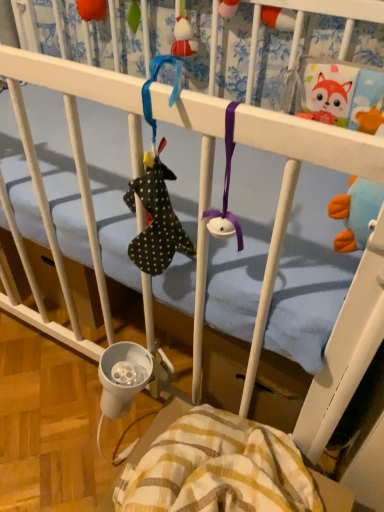
Question: From a real-world perspective, is orange fabric toy at upper left, positioned as the first toy in left-to-right order, physically below matte red plush toy at upper center, the first toy positioned from the right?

Choices:
 (A) yes
 (B) no

Answer: (B)

Question: Does orange fabric toy at upper left, positioned as the first toy in left-to-right order, have a larger size compared to matte red plush toy at upper center, which ranks as the second toy in left-to-right order?

Choices:
 (A) yes
 (B) no

Answer: (B)

Question: Is orange fabric toy at upper left, which is the 2th toy in right-to-left order, at the right side of matte red plush toy at upper center, which ranks as the second toy in left-to-right order?

Choices:
 (A) no
 (B) yes

Answer: (A)

Question: Is orange fabric toy at upper left, positioned as the first toy in left-to-right order, further to camera compared to matte red plush toy at upper center, which ranks as the second toy in left-to-right order?

Choices:
 (A) no
 (B) yes

Answer: (B)

Question: From a real-world perspective, is orange fabric toy at upper left, which is the 2th toy in right-to-left order, physically above matte red plush toy at upper center, the first toy positioned from the right?

Choices:
 (A) yes
 (B) no

Answer: (A)

Question: From a real-world perspective, relative to orange fabric toy at upper left, positioned as the first toy in left-to-right order, is yellow striped fabric at lower center vertically above or below?

Choices:
 (A) above
 (B) below

Answer: (B)

Question: Considering the positions of yellow striped fabric at lower center and orange fabric toy at upper left, which is the 2th toy in right-to-left order, in the image, is yellow striped fabric at lower center bigger or smaller than orange fabric toy at upper left, which is the 2th toy in right-to-left order,?

Choices:
 (A) big
 (B) small

Answer: (A)

Question: Is yellow striped fabric at lower center taller or shorter than orange fabric toy at upper left, which is the 2th toy in right-to-left order?

Choices:
 (A) tall
 (B) short

Answer: (A)

Question: Would you say yellow striped fabric at lower center is to the left or to the right of orange fabric toy at upper left, positioned as the first toy in left-to-right order, in the picture?

Choices:
 (A) right
 (B) left

Answer: (A)

Question: Is orange fabric toy at upper left, positioned as the first toy in left-to-right order, bigger or smaller than yellow striped fabric at lower center?

Choices:
 (A) big
 (B) small

Answer: (B)

Question: From a real-world perspective, is orange fabric toy at upper left, which is the 2th toy in right-to-left order, physically located above or below yellow striped fabric at lower center?

Choices:
 (A) below
 (B) above

Answer: (B)

Question: Considering their positions, is orange fabric toy at upper left, positioned as the first toy in left-to-right order, located in front of or behind yellow striped fabric at lower center?

Choices:
 (A) front
 (B) behind

Answer: (B)

Question: In the image, is orange fabric toy at upper left, which is the 2th toy in right-to-left order, on the left side or the right side of yellow striped fabric at lower center?

Choices:
 (A) right
 (B) left

Answer: (B)

Question: Would you say orange fabric toy at upper left, which is the 2th toy in right-to-left order, is inside or outside matte red plush toy at upper center, which ranks as the second toy in left-to-right order?

Choices:
 (A) inside
 (B) outside

Answer: (B)

Question: From a real-world perspective, is orange fabric toy at upper left, positioned as the first toy in left-to-right order, positioned above or below matte red plush toy at upper center, the first toy positioned from the right?

Choices:
 (A) above
 (B) below

Answer: (A)